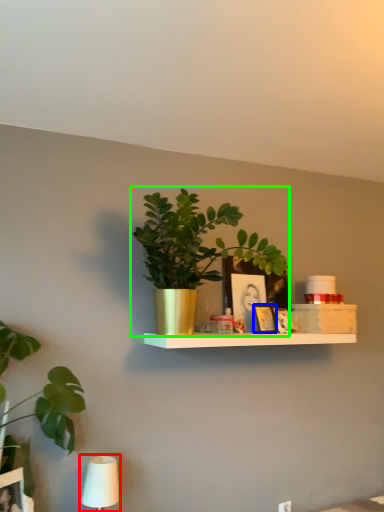
Question: Which object is positioned farthest from table lamp (highlighted by a red box)? Select from picture frame (highlighted by a blue box) and houseplant (highlighted by a green box).

Choices:
 (A) picture frame
 (B) houseplant

Answer: (A)